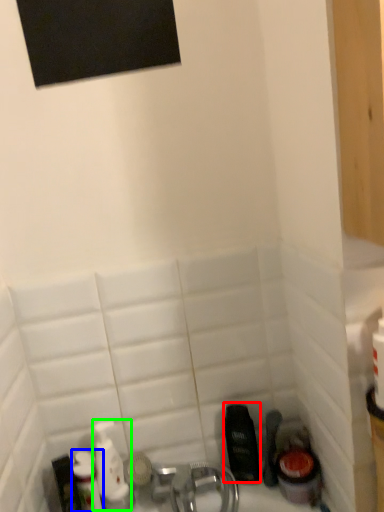
Question: Which object is positioned closest to mouthwash (highlighted by a red box)? Select from toiletry (highlighted by a blue box) and mouthwash (highlighted by a green box).

Choices:
 (A) toiletry
 (B) mouthwash

Answer: (B)